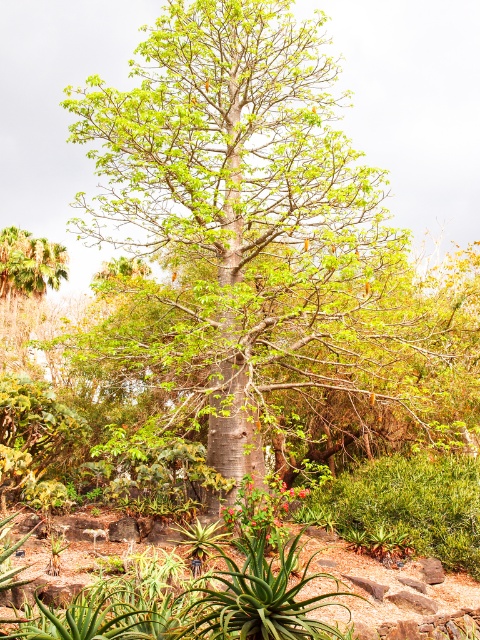
Is smooth bark tree at center wider than bright red petals at center?

Indeed, smooth bark tree at center has a greater width compared to bright red petals at center.

Measure the distance between smooth bark tree at center and camera.

The distance of smooth bark tree at center from camera is 8.63 meters.

In order to click on smooth bark tree at center in this screenshot , I will do `click(247, 221)`.

Is bright red petals at center behind bright red flower at center?

No, bright red petals at center is in front of bright red flower at center.

Can you confirm if bright red petals at center is positioned below bright red flower at center?

Correct, bright red petals at center is located below bright red flower at center.

Consider the image. Who is more distant from viewer, [260,518] or [300,493]?

Positioned behind is point [300,493].

What are the coordinates of `bright red petals at center` in the screenshot? It's located at (260, 508).

Does smooth bark tree at center have a greater width compared to bright red flower at center?

Yes.

I want to click on smooth bark tree at center, so click(x=247, y=221).